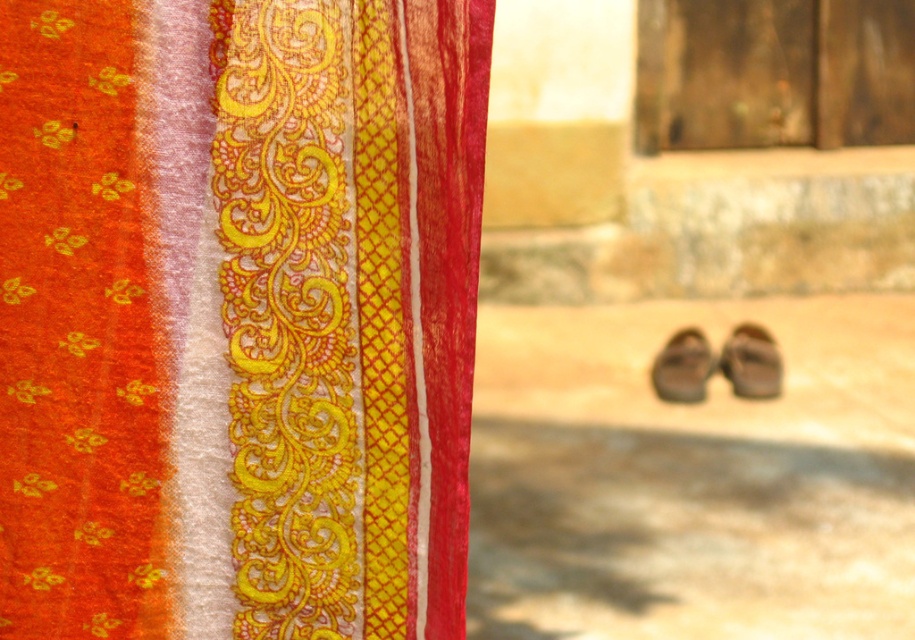
You are arranging a display and need to place the matte gold fabric at upper left and the brown leather shoe at center. According to the image, which object is placed on top of the other?

The matte gold fabric at upper left is positioned over brown leather shoe at center, so the matte gold fabric at upper left is on top of the brown leather shoe at center.

You are organizing a shoe display in a store and have two brown leather shoes. The brown leather shoe at lower right and the brown leather shoe at center. Which one should you place in a narrow shelf space that can only accommodate a thinner shoe?

The brown leather shoe at lower right is thinner than the brown leather shoe at center, so you should place the brown leather shoe at lower right in the narrow shelf space.

You are a tailor working on a project and need to decide which material to use. Given the scene described, which object is smaller in size between the matte gold fabric at upper left and the brown leather shoe at center?

The matte gold fabric at upper left is smaller in size compared to the brown leather shoe at center according to the description.